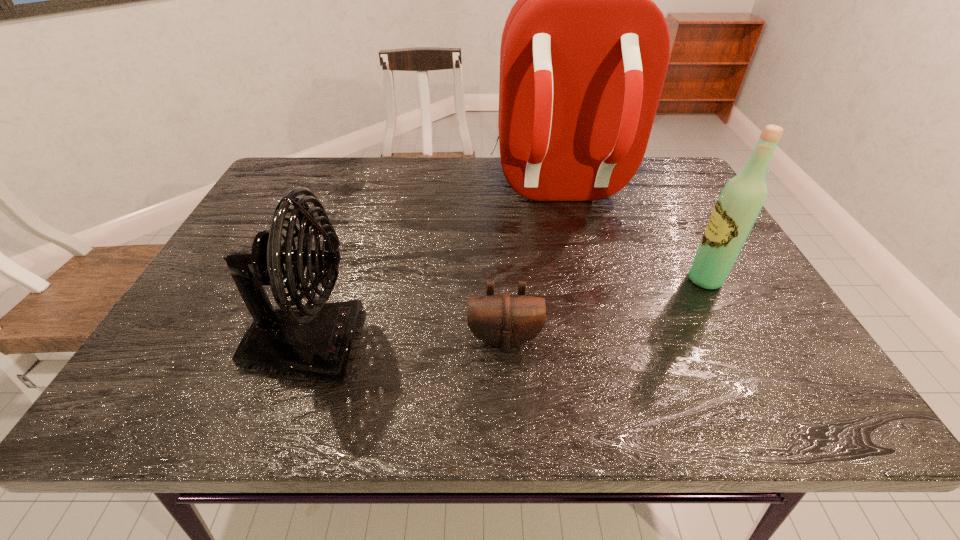
Image resolution: width=960 pixels, height=540 pixels. I want to click on vacant space at the near right corner of the desktop, so click(764, 412).

Locate an element on the screen. free area in between the pouch and the fan is located at coordinates (405, 341).

Find the location of a particular element. empty location between the backpack and the leftmost object is located at coordinates (433, 267).

This screenshot has height=540, width=960. In order to click on free space between the fan and the shortest object in this screenshot , I will do `click(405, 341)`.

At what (x,y) coordinates should I click in order to perform the action: click on free space between the shortest object and the wine bottle. Please return your answer as a coordinate pair (x, y). Looking at the image, I should click on (605, 309).

The height and width of the screenshot is (540, 960). I want to click on vacant area between the wine bottle and the shortest object, so click(605, 309).

Find the location of a particular element. This screenshot has height=540, width=960. empty space that is in between the tallest object and the pouch is located at coordinates (532, 264).

The height and width of the screenshot is (540, 960). Identify the location of free spot between the fan and the farthest object. (433, 267).

Where is `free spot between the pouch and the leftmost object`? This screenshot has height=540, width=960. free spot between the pouch and the leftmost object is located at coordinates 405,341.

What are the coordinates of `empty space that is in between the backpack and the leftmost object` in the screenshot? It's located at (433, 267).